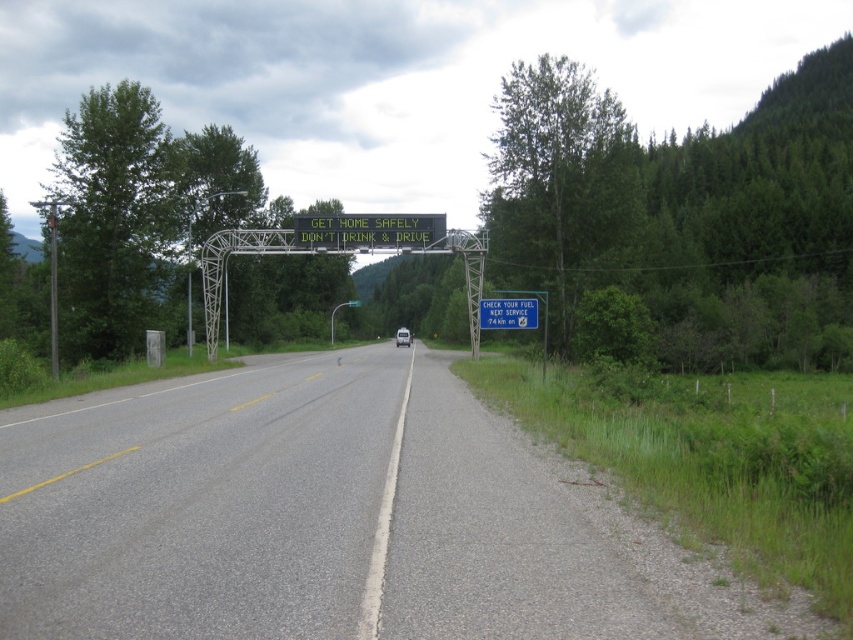
Question: Which is farther from the blue plastic sign at center?

Choices:
 (A) gray asphalt road at center
 (B) white matte van at center
 (C) green electronic sign at center

Answer: (B)

Question: Which point is closer to the camera taking this photo?

Choices:
 (A) (399, 333)
 (B) (480, 300)
 (C) (242, 384)
 (D) (309, 216)

Answer: (C)

Question: Is green electronic sign at center further to camera compared to blue plastic sign at center?

Choices:
 (A) yes
 (B) no

Answer: (A)

Question: Which point is farther to the camera?

Choices:
 (A) blue plastic sign at center
 (B) white matte van at center
 (C) gray asphalt road at center

Answer: (B)

Question: Where is gray asphalt road at center located in relation to white matte van at center in the image?

Choices:
 (A) below
 (B) above

Answer: (A)

Question: From the image, what is the correct spatial relationship of green electronic sign at center in relation to white matte van at center?

Choices:
 (A) right
 (B) left

Answer: (B)